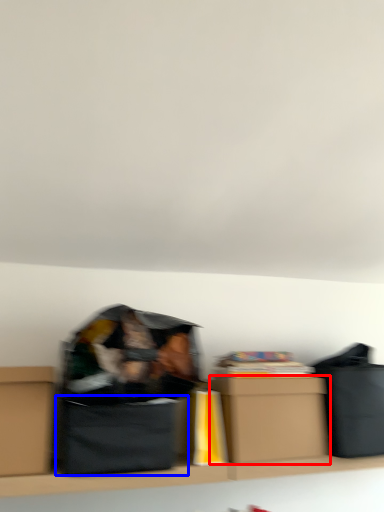
Question: Which object is further to the camera taking this photo, box (highlighted by a red box) or cardboard box (highlighted by a blue box)?

Choices:
 (A) box
 (B) cardboard box

Answer: (A)